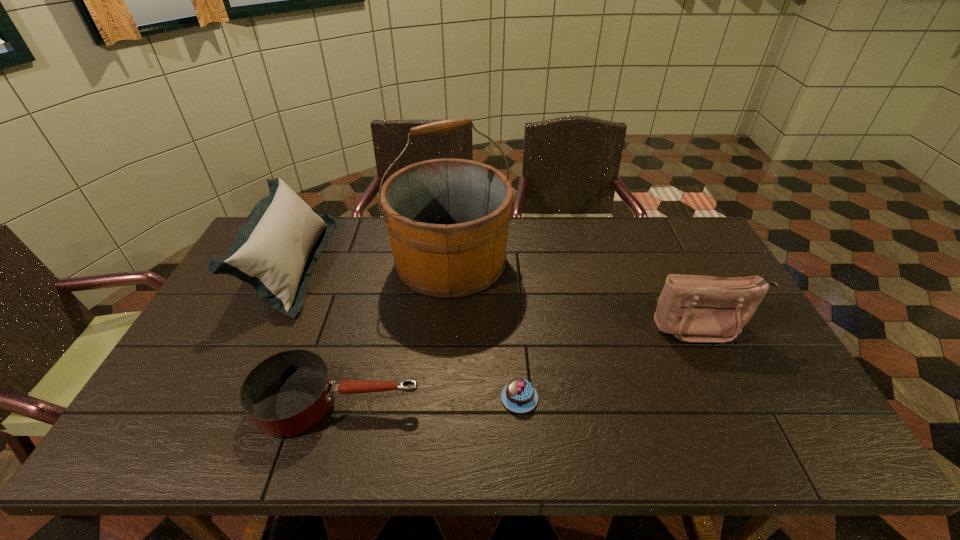
The height and width of the screenshot is (540, 960). Identify the location of bucket at the far edge. (447, 219).

Where is `cushion that is at the far edge`? The height and width of the screenshot is (540, 960). cushion that is at the far edge is located at coordinates (276, 248).

Image resolution: width=960 pixels, height=540 pixels. I want to click on object that is at the near edge, so click(286, 394).

Image resolution: width=960 pixels, height=540 pixels. What are the coordinates of `object that is at the left edge` in the screenshot? It's located at (276, 248).

Locate an element on the screen. object that is at the right edge is located at coordinates (693, 308).

What are the coordinates of `object that is positioned at the far left corner` in the screenshot? It's located at (276, 248).

The width and height of the screenshot is (960, 540). In the image, there is a desktop. Identify the location of vacant space at the far edge. (363, 241).

Identify the location of vacant space at the near edge. (553, 430).

In the image, there is a desktop. Where is `free space at the left edge`? This screenshot has width=960, height=540. free space at the left edge is located at coordinates (175, 394).

This screenshot has height=540, width=960. What are the coordinates of `free spot at the right edge of the desktop` in the screenshot? It's located at pyautogui.click(x=717, y=353).